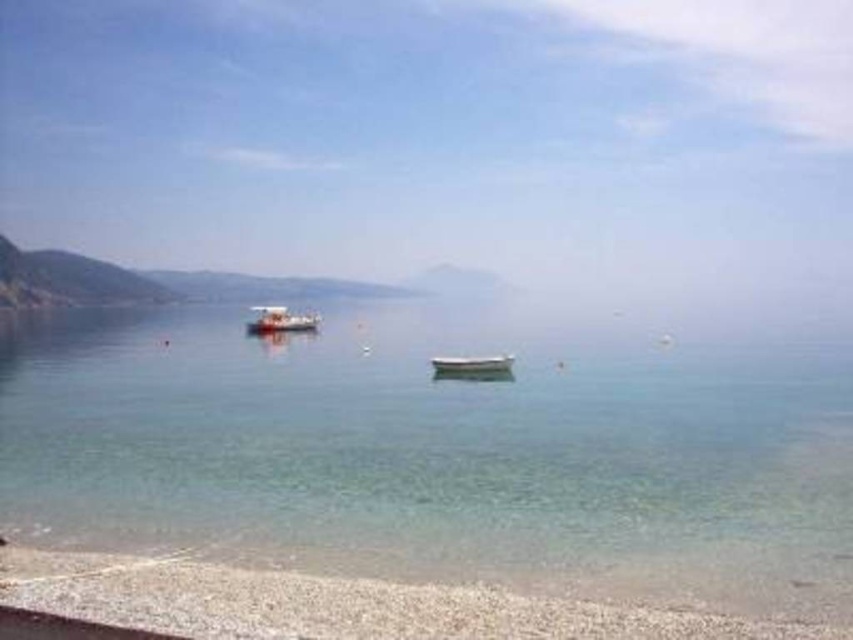
You are standing at the shore of the coastal scene and want to determine the position of two points in the image. Which point, point (54, 593) or point (262, 323), is closer to you?

Point (54, 593) is closer to the camera than point (262, 323), so it is closer to you.

You are standing on the white gravel beach at lower left and want to reach the metallic silver boat at left. Which direction should you move to get closer to the boat?

Since the white gravel beach at lower left is smaller than the metallic silver boat at left, you should move towards the left to get closer to the boat.

You are standing at the point marked by the coordinates point (x=341, y=604). Based on the scene described, what type of terrain are you currently standing on?

The point (x=341, y=604) is on the white gravel beach at lower left, so you are standing on a pebble beach with small, light colored stones.